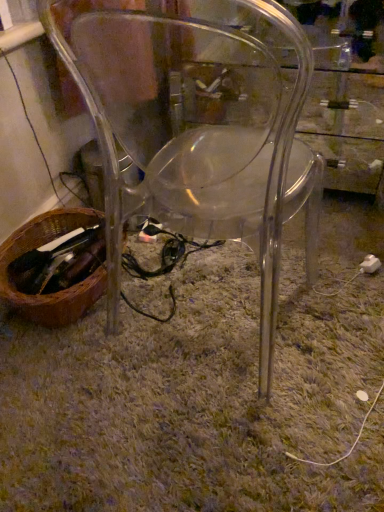
Question: In the image, is brown woven basket at lower left on the left side or the right side of white plastic plug at lower right?

Choices:
 (A) right
 (B) left

Answer: (B)

Question: Is brown woven basket at lower left in front of or behind white plastic plug at lower right in the image?

Choices:
 (A) behind
 (B) front

Answer: (B)

Question: Which object is the closest to the white plastic plug at lower right?

Choices:
 (A) green shaggy carpet at center
 (B) transparent plastic chair at center
 (C) brown woven basket at lower left

Answer: (A)

Question: Which object is positioned farthest from the white plastic plug at lower right?

Choices:
 (A) transparent plastic chair at center
 (B) brown woven basket at lower left
 (C) green shaggy carpet at center

Answer: (B)